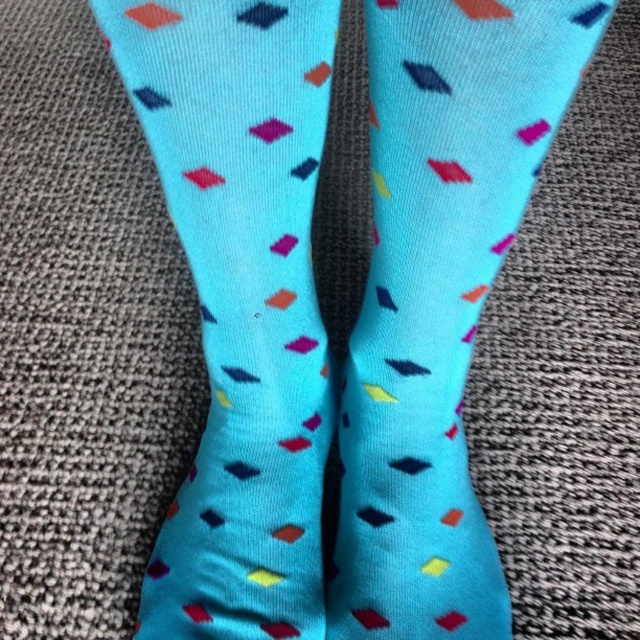
You are trying to decide which sock to wear. You see the matte blue socks at center and the turquoise knitted socks at center. Which one is on the right side?

The matte blue socks at center is positioned on the right side of the turquoise knitted socks at center.

Based on the photo, you are trying to decide between two pairs of socks for a cold day. You have the matte blue socks at center and the turquoise knitted socks at center. Which pair would you choose if you want the thicker socks?

The turquoise knitted socks at center are thicker than the matte blue socks at center, so you should choose the turquoise knitted socks at center for a colder day.

You are a photographer setting up a shot of the matte blue socks at center. The camera requires the subject to be exactly 18 inches away to focus properly. Based on the scene description, is the current distance sufficient for proper focus?

The matte blue socks at center is 17.49 inches away from camera, which is slightly less than the required 18 inches. Therefore, the current distance is not sufficient for proper focus. The photographer should move the socks or the camera back by approximately 0.51 inches to achieve the correct focus distance.